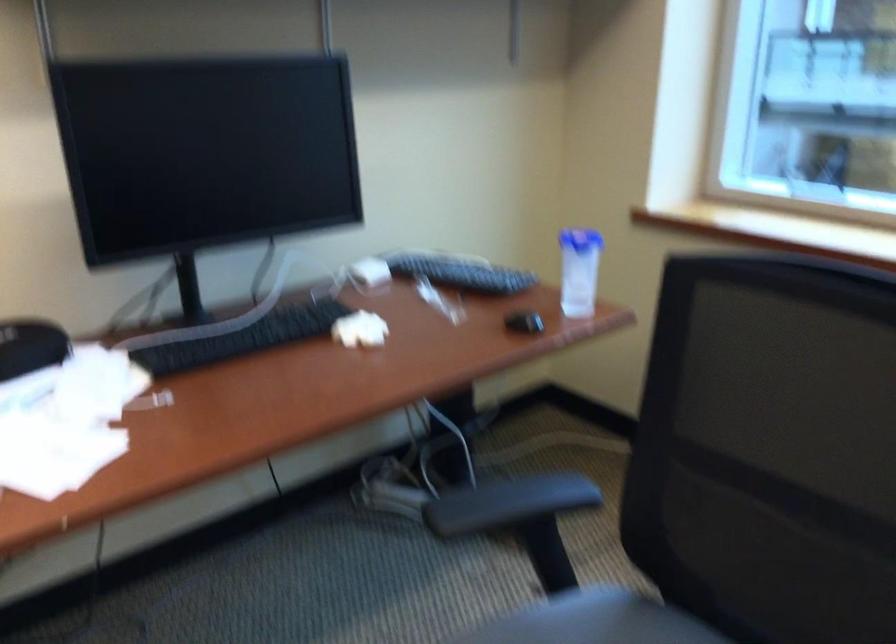
Where would you open the blue bottle lid? Please return your answer as a coordinate pair (x, y).

(581, 240)